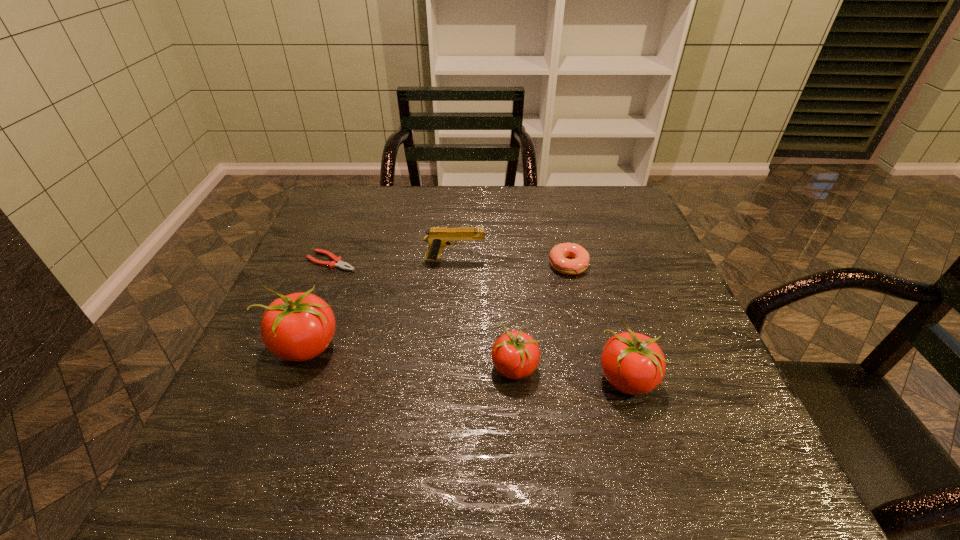
Where is `blank space that satisfies the following two spatial constraints: 1. on the front side of the rightmost tomato; 2. on the right side of the shortest object`? The height and width of the screenshot is (540, 960). blank space that satisfies the following two spatial constraints: 1. on the front side of the rightmost tomato; 2. on the right side of the shortest object is located at coordinates (285, 379).

At what (x,y) coordinates should I click in order to perform the action: click on vacant space that satisfies the following two spatial constraints: 1. on the front side of the second shortest tomato; 2. on the right side of the shortest object. Please return your answer as a coordinate pair (x, y). Looking at the image, I should click on (285, 379).

Where is `vacant space that satisfies the following two spatial constraints: 1. on the front side of the rightmost tomato; 2. on the left side of the pliers`? This screenshot has height=540, width=960. vacant space that satisfies the following two spatial constraints: 1. on the front side of the rightmost tomato; 2. on the left side of the pliers is located at coordinates (285, 379).

Where is `vacant area that satisfies the following two spatial constraints: 1. at the barrel of the second shortest object; 2. on the right side of the pistol`? This screenshot has height=540, width=960. vacant area that satisfies the following two spatial constraints: 1. at the barrel of the second shortest object; 2. on the right side of the pistol is located at coordinates (454, 265).

At what (x,y) coordinates should I click in order to perform the action: click on vacant position in the image that satisfies the following two spatial constraints: 1. on the back side of the tallest object; 2. on the left side of the fifth tallest object. Please return your answer as a coordinate pair (x, y). Looking at the image, I should click on (338, 265).